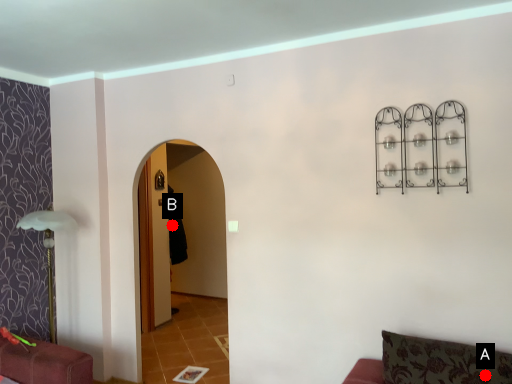
Question: Two points are circled on the image, labeled by A and B beside each circle. Which point is farther to the camera?

Choices:
 (A) A is further
 (B) B is further

Answer: (B)